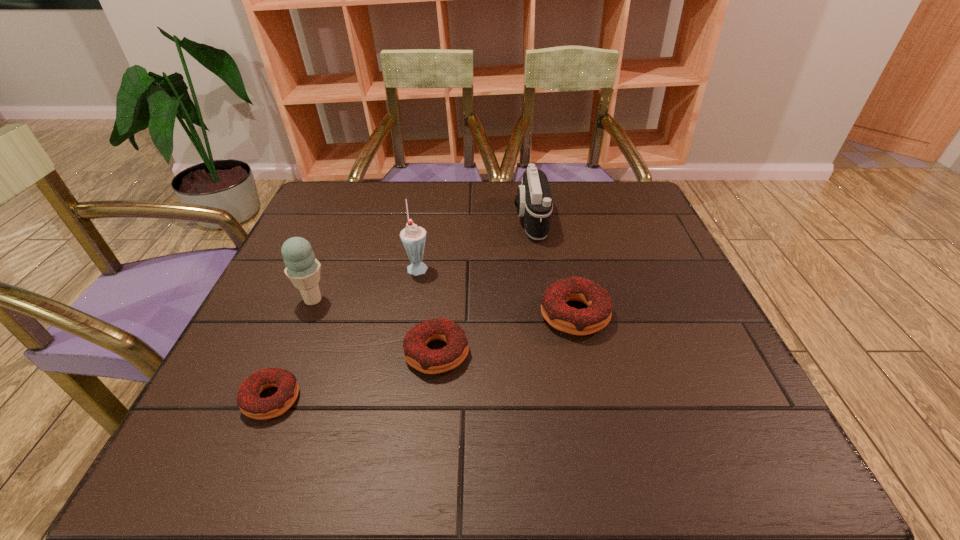
This screenshot has height=540, width=960. I want to click on free location that satisfies the following two spatial constraints: 1. on the straw side of the fifth tallest object; 2. on the right side of the milkshake, so click(x=403, y=353).

Locate an element on the screen. free point that satisfies the following two spatial constraints: 1. on the back side of the rightmost doughnut; 2. on the straw side of the second farthest object is located at coordinates (564, 266).

Where is `vacant space that satisfies the following two spatial constraints: 1. on the back side of the fifth tallest object; 2. on the straw side of the milkshake`? The width and height of the screenshot is (960, 540). vacant space that satisfies the following two spatial constraints: 1. on the back side of the fifth tallest object; 2. on the straw side of the milkshake is located at coordinates (444, 266).